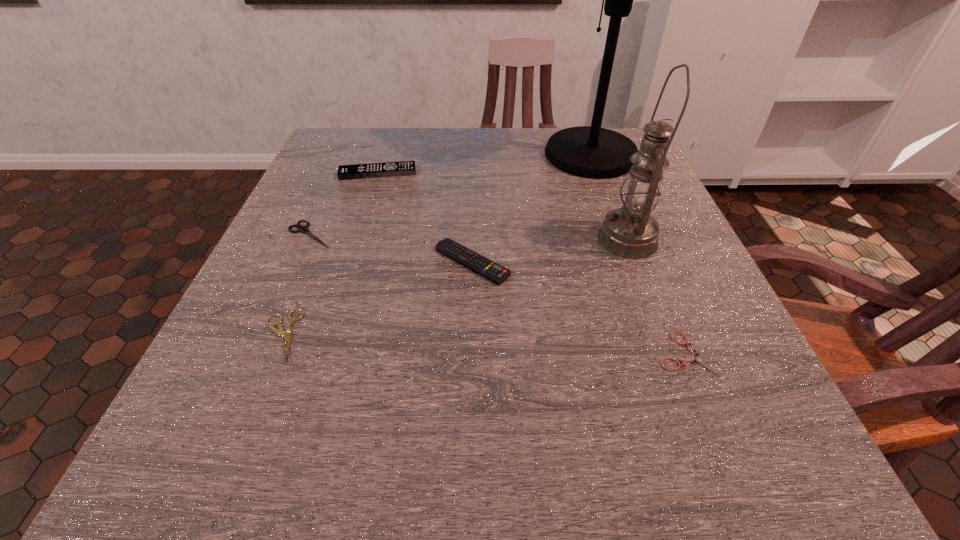
I want to click on remote control that is at the left edge, so click(x=404, y=168).

The height and width of the screenshot is (540, 960). Find the location of `table lamp positioned at the right edge`. table lamp positioned at the right edge is located at coordinates (593, 152).

The image size is (960, 540). I want to click on oil lamp that is at the right edge, so click(x=631, y=232).

Locate an element on the screen. This screenshot has height=540, width=960. shears that is at the right edge is located at coordinates (701, 360).

This screenshot has width=960, height=540. I want to click on object located at the far left corner, so [404, 168].

Image resolution: width=960 pixels, height=540 pixels. In order to click on object that is positioned at the far right corner in this screenshot , I will do `click(593, 152)`.

Find the location of a particular element. Image resolution: width=960 pixels, height=540 pixels. free spot at the far edge of the desktop is located at coordinates (477, 141).

This screenshot has height=540, width=960. Find the location of `free location at the near edge of the desktop`. free location at the near edge of the desktop is located at coordinates 492,438.

You are a GUI agent. You are given a task and a screenshot of the screen. Output one action in this format:
    pyautogui.click(x=<x>, y=<y>)
    Task: Click on the free region at the left edge of the desktop
    The height and width of the screenshot is (540, 960).
    Given the screenshot: What is the action you would take?
    pyautogui.click(x=285, y=284)

Where is `vacant area at the right edge`? This screenshot has width=960, height=540. vacant area at the right edge is located at coordinates click(685, 329).